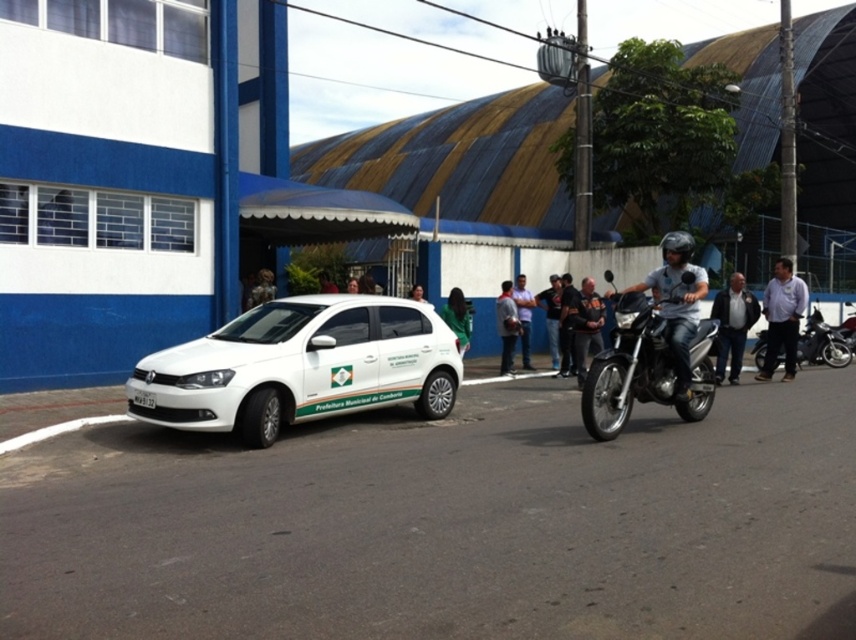
You are a delivery driver who needs to park your vehicle between the white matte hatchback at center and the shiny silver motorcycle at right. Can you fit your delivery van, which is 1.8 meters wide, in the available space between them?

The white matte hatchback at center is smaller than the shiny silver motorcycle at right, but the exact width of the space between them isn